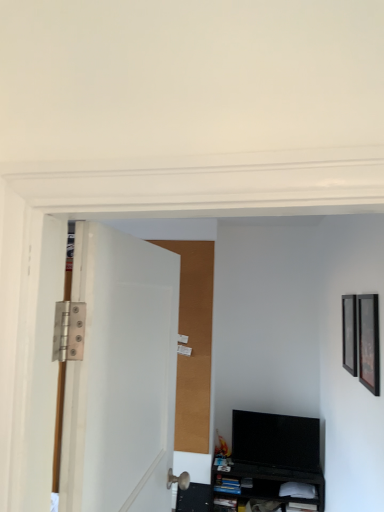
Question: Considering the positions of white matte door at left and black matte cabinet at lower center in the image, is white matte door at left taller or shorter than black matte cabinet at lower center?

Choices:
 (A) tall
 (B) short

Answer: (A)

Question: Considering the positions of white matte door at left and black matte cabinet at lower center in the image, is white matte door at left wider or thinner than black matte cabinet at lower center?

Choices:
 (A) wide
 (B) thin

Answer: (B)

Question: Which object is the farthest from the black glossy tv at lower right?

Choices:
 (A) white matte door at left
 (B) black matte shelf at lower center
 (C) black matte cabinet at lower center
 (D) black matte picture frame at right, the 2th picture frame when ordered from left to right
 (E) black glossy picture frame at right, the 1th picture frame positioned from the front

Answer: (A)

Question: Estimate the real-world distances between objects in this image. Which object is farther from the black glossy tv at lower right?

Choices:
 (A) black matte shelf at lower center
 (B) black matte cabinet at lower center
 (C) white matte door at left
 (D) black glossy picture frame at right, placed as the first picture frame when sorted from left to right
 (E) black matte picture frame at right, the 2th picture frame when ordered from left to right

Answer: (C)